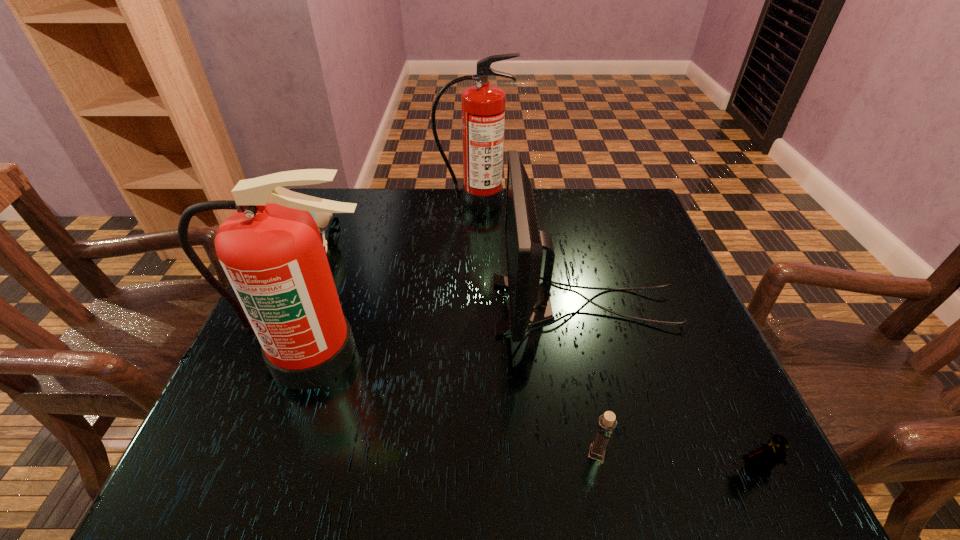
Identify the location of computer monitor that is positioned at the right edge. (530, 305).

Where is `Lego that is at the right edge`? This screenshot has width=960, height=540. Lego that is at the right edge is located at coordinates (762, 461).

This screenshot has height=540, width=960. I want to click on object that is at the far left corner, so click(x=322, y=219).

Identify the location of object at the near right corner. The width and height of the screenshot is (960, 540). (762, 461).

Locate an element on the screen. free space at the far edge is located at coordinates (389, 237).

Locate an element on the screen. This screenshot has width=960, height=540. vacant space at the near edge of the desktop is located at coordinates (642, 464).

Find the location of a particular element. vacant space at the left edge of the desktop is located at coordinates (342, 273).

Identify the location of vacant space at the right edge of the desktop. (662, 275).

Identify the location of free space at the far left corner of the desktop. The height and width of the screenshot is (540, 960). (351, 191).

I want to click on free location at the near left corner, so click(261, 473).